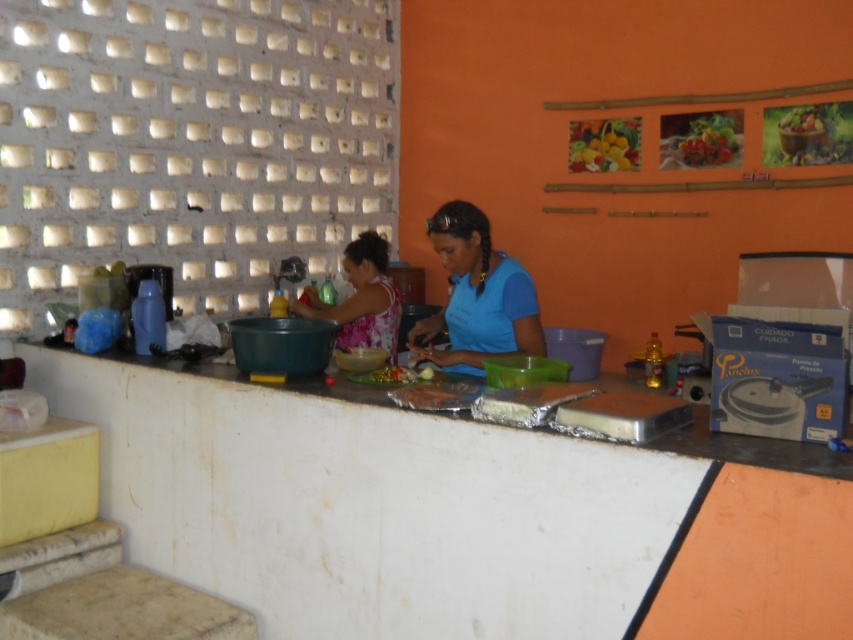
You are standing in the kitchen and want to place a small bowl between the two points marked as point [384,340] and point [409,380]. Which point should the bowl be closer to if you want it to be nearer to the viewer?

The bowl should be placed closer to point [384,340] because it is further to the viewer than point [409,380].

Where is the floral fabric shirt at center located?

The floral fabric shirt at center is located at point 0.467 on the x axis and 0.423 on the y axis.